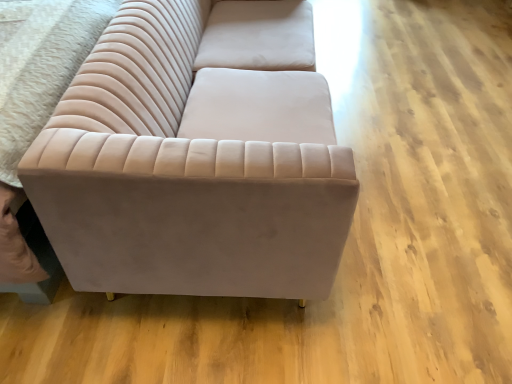
What is the approximate width of matte pink fabric couch at center?

matte pink fabric couch at center is 36.12 inches in width.

Measure the distance between point [219,123] and camera.

A distance of 5.00 feet exists between point [219,123] and camera.

At what (x,y) coordinates should I click in order to perform the action: click on matte pink fabric couch at center. Please return your answer as a coordinate pair (x, y). The width and height of the screenshot is (512, 384). Looking at the image, I should click on (190, 169).

Describe the element at coordinates (190, 169) in the screenshot. I see `matte pink fabric couch at center` at that location.

In order to click on matte pink fabric couch at center in this screenshot , I will do `click(190, 169)`.